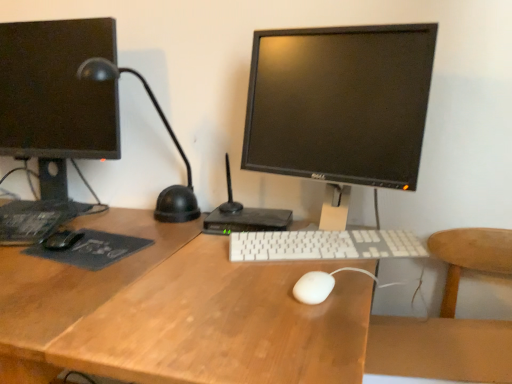
Locate an element on the screen. The width and height of the screenshot is (512, 384). vacant space that's between white matte mouse at center, which ranks as the 1th mouse in bottom-to-top order, and dark gray matte mousepad at left is located at coordinates (196, 264).